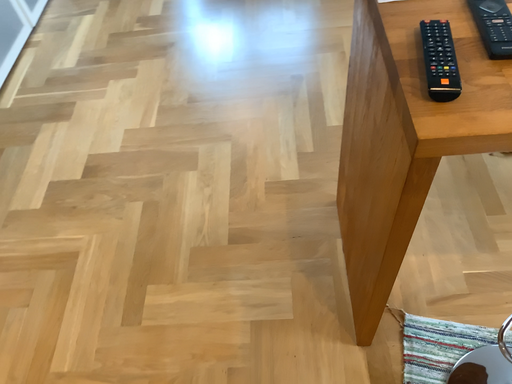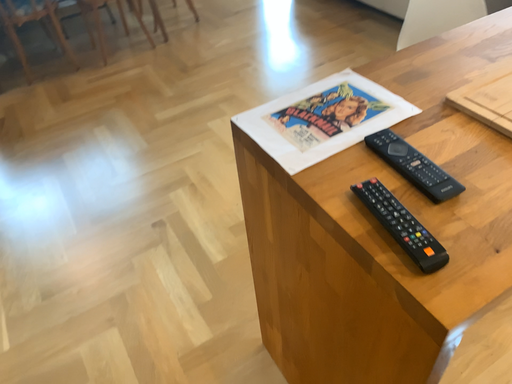
Question: Which way did the camera rotate in the video?

Choices:
 (A) rotated left
 (B) rotated right

Answer: (B)